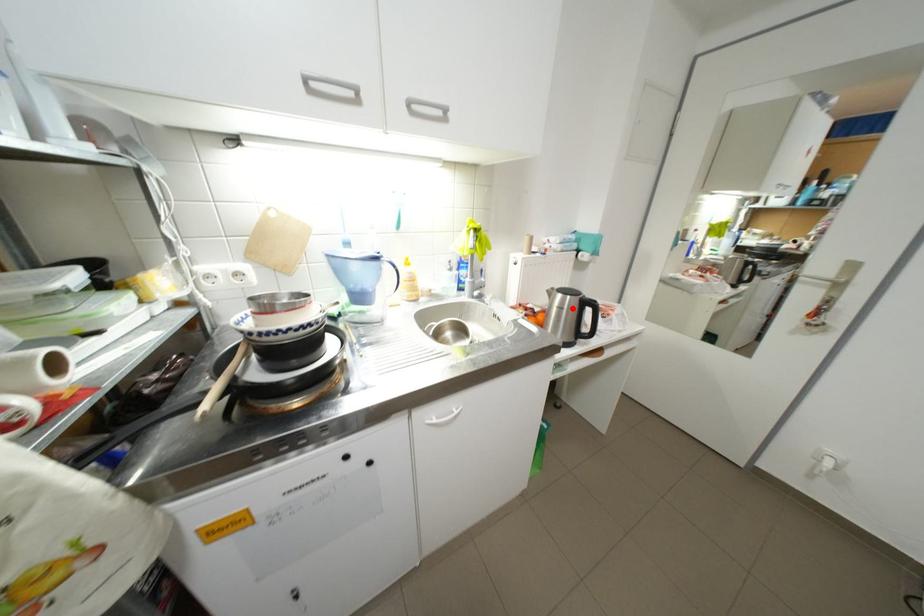
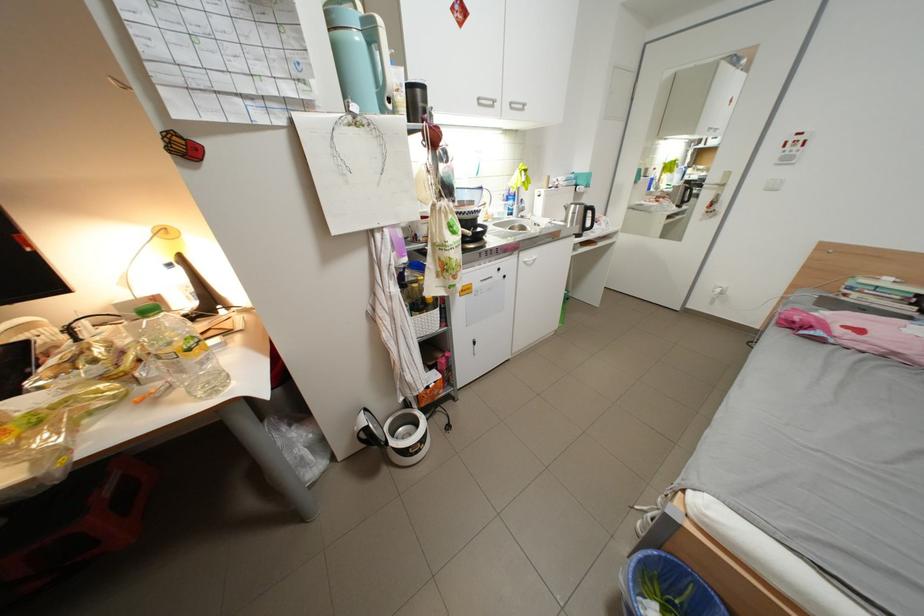
Locate, in the second image, the point that corresponds to the highlighted location in the first image.

(585, 215)